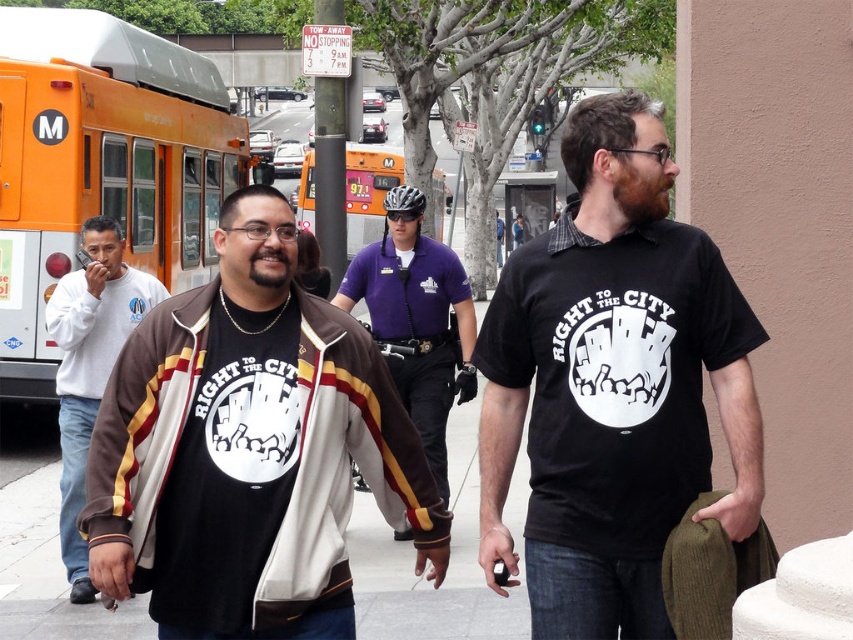
Question: Is purple uniform shirt at center wider than white cotton sweatshirt at left?

Choices:
 (A) no
 (B) yes

Answer: (B)

Question: Can you confirm if black cotton t-shirt at center is bigger than white cotton sweatshirt at left?

Choices:
 (A) no
 (B) yes

Answer: (A)

Question: Which is farther from the white cotton sweatshirt at left?

Choices:
 (A) purple uniform shirt at center
 (B) orange metallic bus at left
 (C) orange metallic bus at center

Answer: (C)

Question: Where is brown suede jacket at center located in relation to purple uniform shirt at center in the image?

Choices:
 (A) below
 (B) above

Answer: (A)

Question: Which of these objects is positioned farthest from the white cotton sweatshirt at left?

Choices:
 (A) brown suede jacket at center
 (B) orange metallic bus at left
 (C) orange metallic bus at center

Answer: (C)

Question: Estimate the real-world distances between objects in this image. Which object is farther from the orange metallic bus at left?

Choices:
 (A) brown suede jacket at center
 (B) white cotton sweatshirt at left
 (C) orange metallic bus at center

Answer: (C)